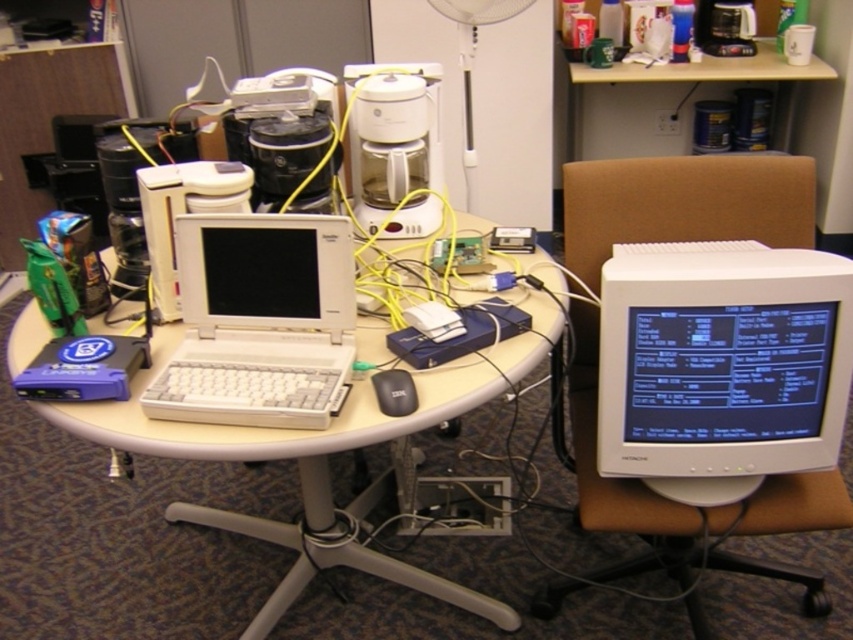
You are a technician who needs to connect a cable that is 10 inches long between the white plastic table at center and the white plastic monitor at center. Will the cable reach?

The white plastic table at center is 9.51 inches away from the white plastic monitor at center. Since the cable is 10 inches long, it will be sufficient to connect them.

You are a person who needs to reach the black matte mouse at center from the brown leather swivel chair at right. Can you comfortably reach it without moving your chair?

The brown leather swivel chair at right and black matte mouse at center are 26.19 inches apart from each other. Since the average comfortable reaching distance for most adults is around 24 inches, you might need to adjust your chair or lean forward slightly to comfortably reach the black matte mouse at center.